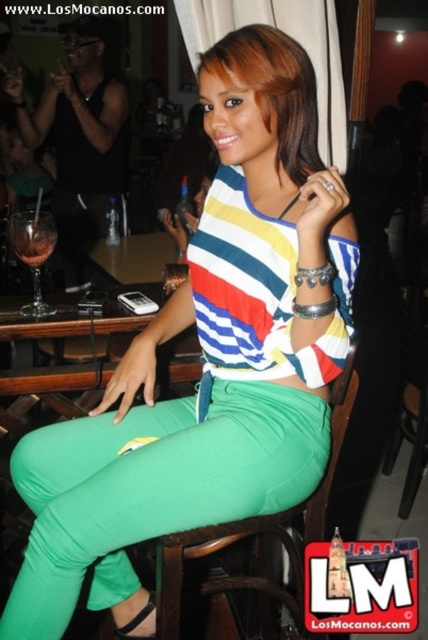
You are a photographer setting up a shoot in this bar or restaurant scene. You need to place a small prop between the green fabric pants at center and the green fabric chair at center. Based on their positions, which side of the chair should you place the prop on?

The green fabric pants at center are to the left of the green fabric chair at center, so you should place the prop to the left side of the chair.

You are a bartender preparing to place a drink on a surface. You see the green fabric chair at center and the translucent glass wine at left. Which object is located above the other?

The translucent glass wine at left is located above the green fabric chair at center because the green fabric chair at center is positioned under the translucent glass wine at left.